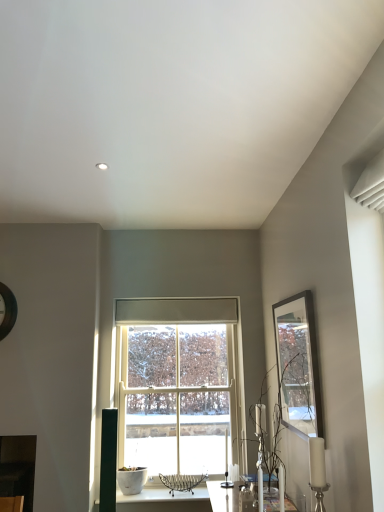
Question: Should I look upward or downward to see translucent glass vase at right?

Choices:
 (A) down
 (B) up

Answer: (A)

Question: Can white wooden window at center be found inside matte black picture frame at upper right?

Choices:
 (A) no
 (B) yes

Answer: (A)

Question: Does matte black picture frame at upper right have a greater height compared to white wooden window at center?

Choices:
 (A) yes
 (B) no

Answer: (B)

Question: Is matte black picture frame at upper right shorter than white wooden window at center?

Choices:
 (A) yes
 (B) no

Answer: (A)

Question: Considering the relative positions of matte black picture frame at upper right and white wooden window at center in the image provided, is matte black picture frame at upper right to the right of white wooden window at center from the viewer's perspective?

Choices:
 (A) no
 (B) yes

Answer: (B)

Question: Is matte black picture frame at upper right positioned with its back to white wooden window at center?

Choices:
 (A) yes
 (B) no

Answer: (B)

Question: Can you confirm if matte black picture frame at upper right is smaller than white wooden window at center?

Choices:
 (A) no
 (B) yes

Answer: (B)

Question: Is translucent glass vase at right not within white wooden window at center?

Choices:
 (A) yes
 (B) no

Answer: (A)

Question: Is translucent glass vase at right shorter than white wooden window at center?

Choices:
 (A) yes
 (B) no

Answer: (A)

Question: Can you confirm if translucent glass vase at right is positioned to the left of white wooden window at center?

Choices:
 (A) no
 (B) yes

Answer: (A)

Question: From a real-world perspective, is translucent glass vase at right physically below white wooden window at center?

Choices:
 (A) no
 (B) yes

Answer: (B)

Question: From the image's perspective, is translucent glass vase at right located above white wooden window at center?

Choices:
 (A) yes
 (B) no

Answer: (A)

Question: Does translucent glass vase at right come behind white wooden window at center?

Choices:
 (A) yes
 (B) no

Answer: (B)

Question: Can you confirm if white wooden window at center is thinner than translucent glass vase at right?

Choices:
 (A) no
 (B) yes

Answer: (B)